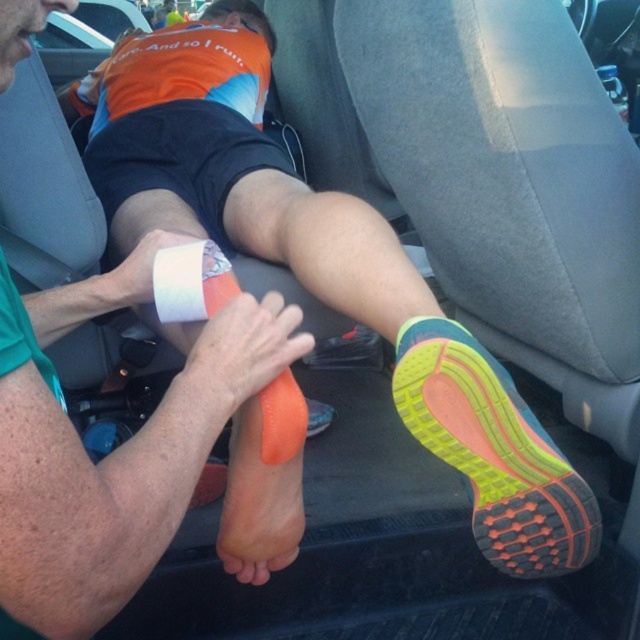
You are a passenger in the back seat of a car and want to put on your shoes. You see a matte orange sock at center and an orange foam at center. Which item should you choose to wear on your foot first?

The matte orange sock at center has a larger size compared to the orange foam at center, so you should put on the matte orange sock at center first as it is bigger and likely designed to be worn over the foot before the smaller foam.